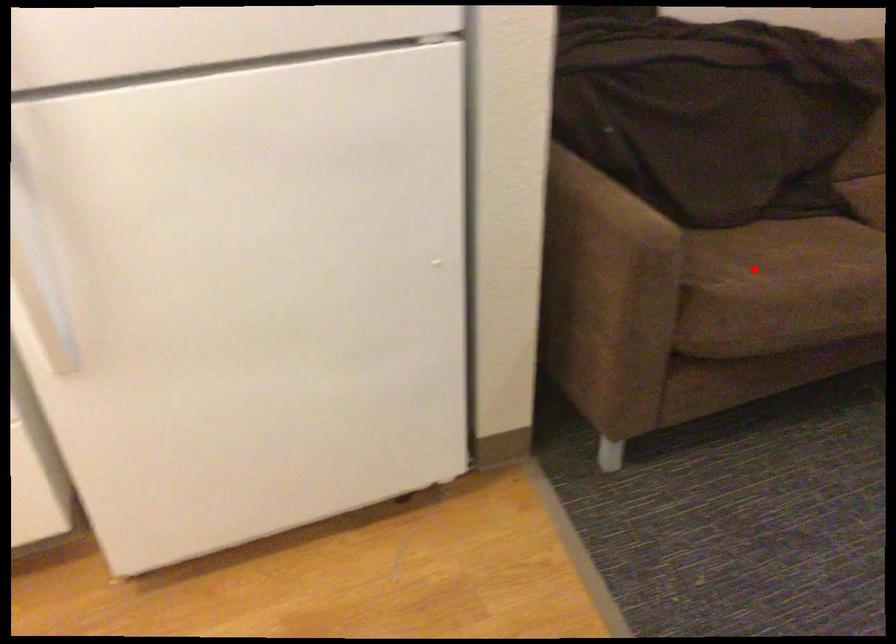
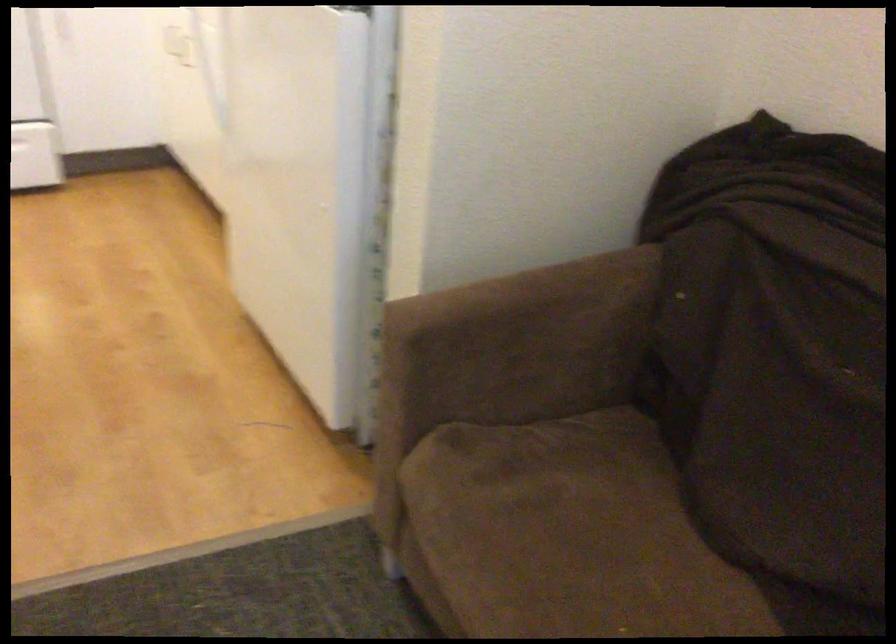
The point at the highlighted location is marked in the first image. Where is the corresponding point in the second image?

(563, 542)